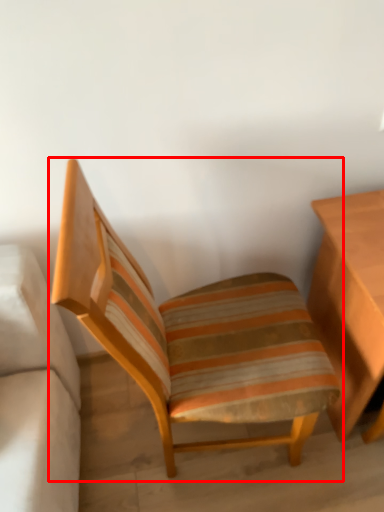
Question: Where is chair (annotated by the red box) located in relation to table in the image?

Choices:
 (A) right
 (B) left

Answer: (B)